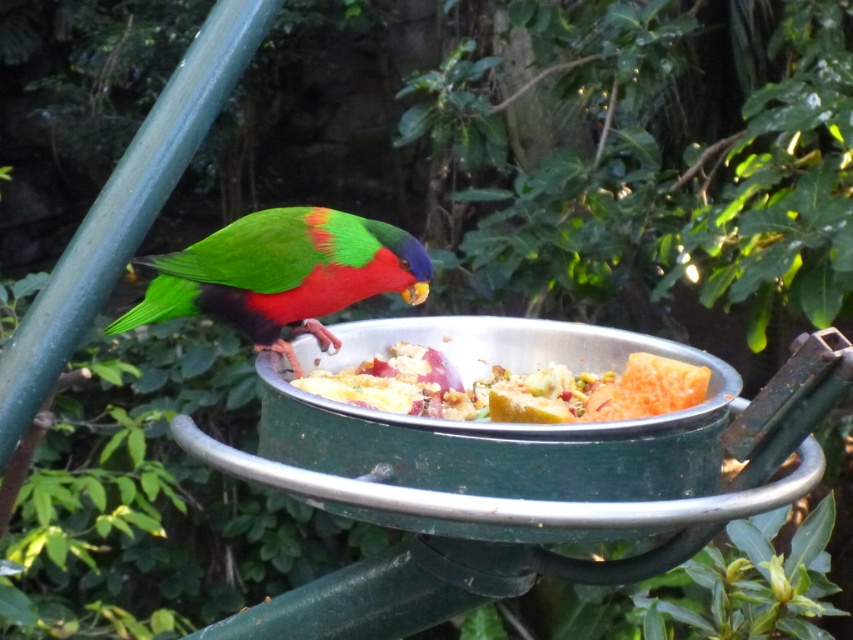
Question: Among these points, which one is nearest to the camera?

Choices:
 (A) (138, 321)
 (B) (389, 412)

Answer: (B)

Question: Does metallic silver bird feeder at center appear on the right side of green matte parrot at center?

Choices:
 (A) yes
 (B) no

Answer: (A)

Question: Is green matte parrot at center to the right of shiny metallic bowl at center from the viewer's perspective?

Choices:
 (A) yes
 (B) no

Answer: (B)

Question: Which point appears farthest from the camera in this image?

Choices:
 (A) (308, 376)
 (B) (337, 305)

Answer: (B)

Question: Is green matte parrot at center to the left of shiny metallic bowl at center from the viewer's perspective?

Choices:
 (A) no
 (B) yes

Answer: (B)

Question: Estimate the real-world distances between objects in this image. Which object is farther from the green matte parrot at center?

Choices:
 (A) shiny metallic bowl at center
 (B) metallic silver bird feeder at center

Answer: (B)